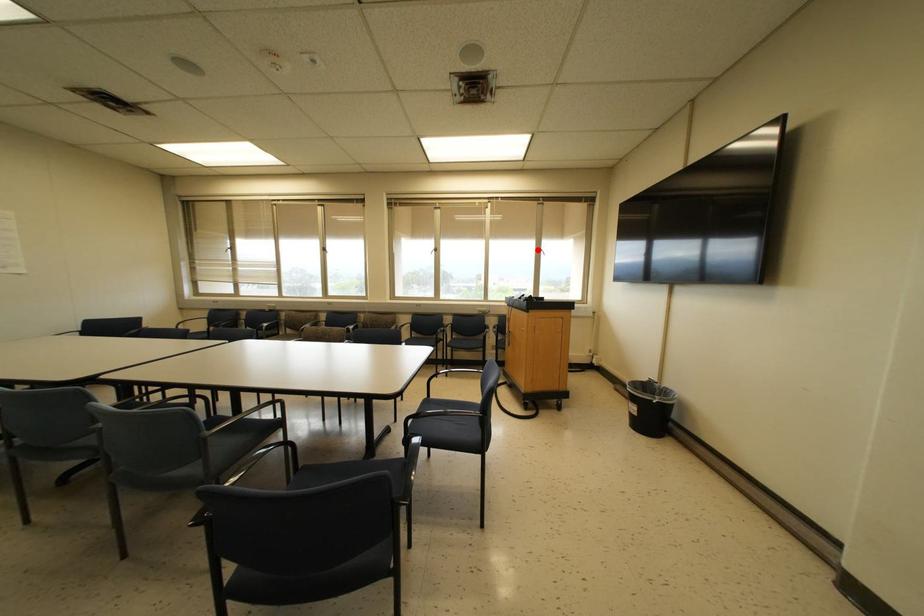
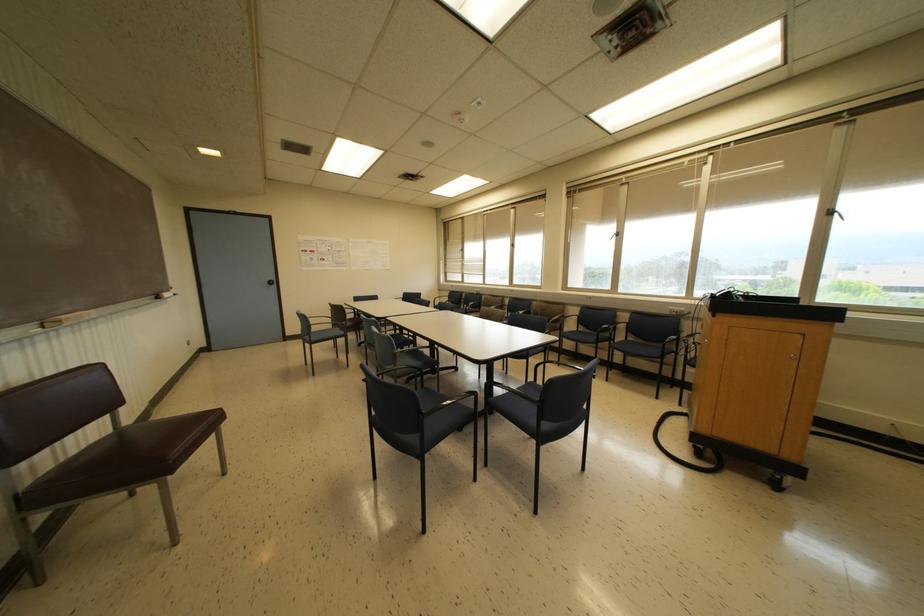
Question: I am providing you with two images of the same scene from different viewpoints. A red point is shown in image1. For the corresponding object point in image2, is it positioned nearer or farther from the camera?

Choices:
 (A) Nearer
 (B) Farther

Answer: (B)